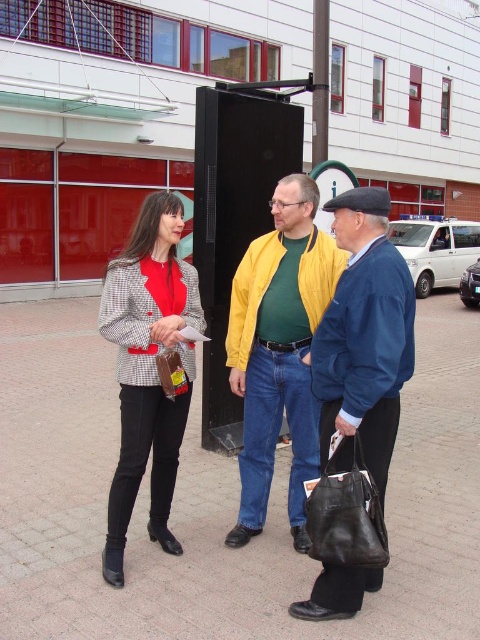
You are standing in front of the modern building with the red facade and looking at the two people in the foreground. Which of the two jackets, the matte yellow jacket at center or the matte blue jacket at center, is positioned lower?

The matte yellow jacket at center is located below the matte blue jacket at center, so the matte yellow jacket at center is positioned lower.